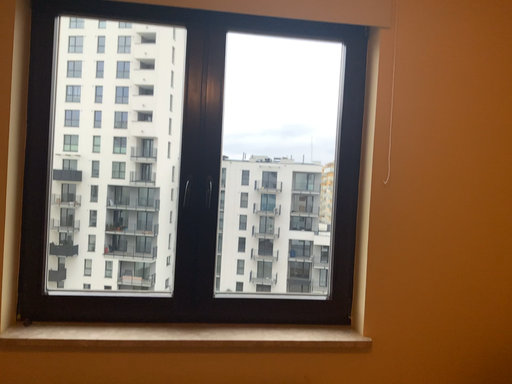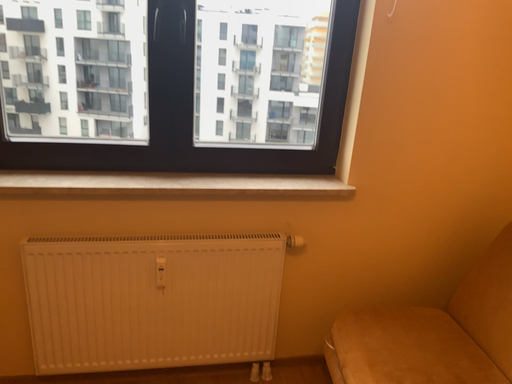
Question: How did the camera likely rotate when shooting the video?

Choices:
 (A) rotated downward
 (B) rotated upward

Answer: (A)